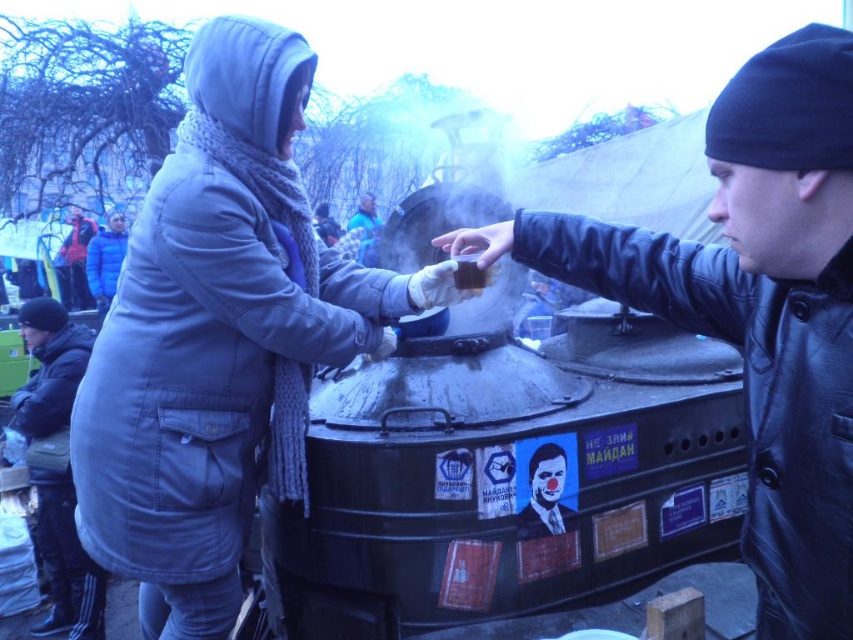
Question: Which point is farther to the camera?

Choices:
 (A) black leather jacket at center
 (B) dark blue leather jacket at lower left

Answer: (B)

Question: Does matte gray coat at center come behind dark blue leather jacket at lower left?

Choices:
 (A) yes
 (B) no

Answer: (B)

Question: Can you confirm if black leather jacket at center is positioned to the left of dark blue leather jacket at lower left?

Choices:
 (A) no
 (B) yes

Answer: (A)

Question: Which point appears closest to the camera in this image?

Choices:
 (A) 131,352
 (B) 849,566
 (C) 59,612

Answer: (B)

Question: Which point appears farthest from the camera in this image?

Choices:
 (A) (230, 328)
 (B) (755, 195)
 (C) (61, 572)

Answer: (C)

Question: From the image, what is the correct spatial relationship of black leather jacket at center in relation to dark blue leather jacket at lower left?

Choices:
 (A) above
 (B) below

Answer: (A)